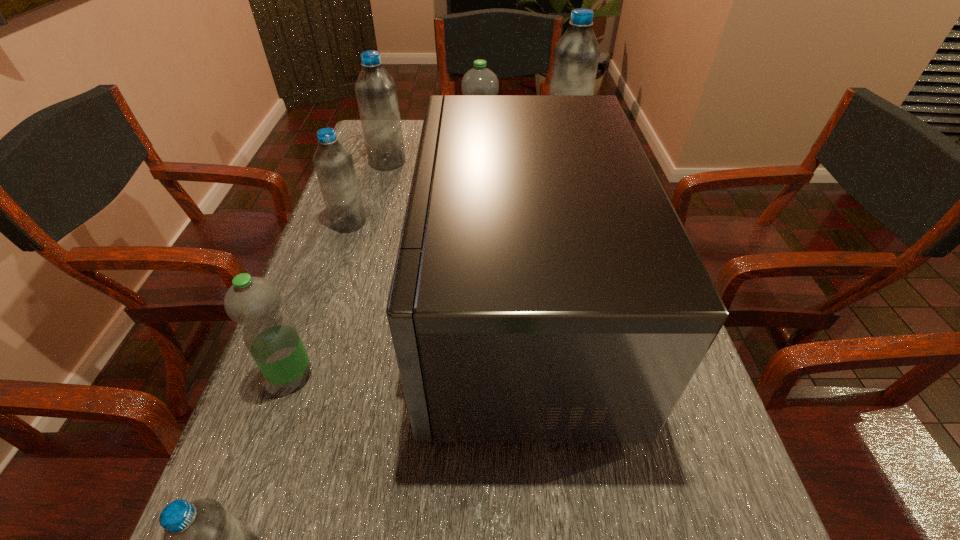
The height and width of the screenshot is (540, 960). Identify the location of the rightmost water bottle. (576, 55).

You are a GUI agent. You are given a task and a screenshot of the screen. Output one action in this format:
    pyautogui.click(x=<x>, y=<y>)
    Task: Click on the biggest blue water bottle
    The height and width of the screenshot is (540, 960).
    Given the screenshot: What is the action you would take?
    pyautogui.click(x=576, y=55)

Locate an element on the screen. The width and height of the screenshot is (960, 540). microwave oven is located at coordinates (545, 290).

Identify the location of the farther green water bottle. Image resolution: width=960 pixels, height=540 pixels. pos(479,80).

At what (x,y) coordinates should I click in order to perform the action: click on the right green water bottle. Please return your answer as a coordinate pair (x, y). This screenshot has width=960, height=540. Looking at the image, I should click on (479, 80).

I want to click on the third smallest blue water bottle, so click(375, 89).

Where is `the third nearest water bottle`? The image size is (960, 540). the third nearest water bottle is located at coordinates (334, 166).

What are the coordinates of `the second smallest blue water bottle` in the screenshot? It's located at (334, 166).

Locate an element on the screen. Image resolution: width=960 pixels, height=540 pixels. the left green water bottle is located at coordinates click(x=270, y=336).

At what (x,y) coordinates should I click in order to perform the action: click on the fifth farthest water bottle. Please return your answer as a coordinate pair (x, y). Looking at the image, I should click on (270, 336).